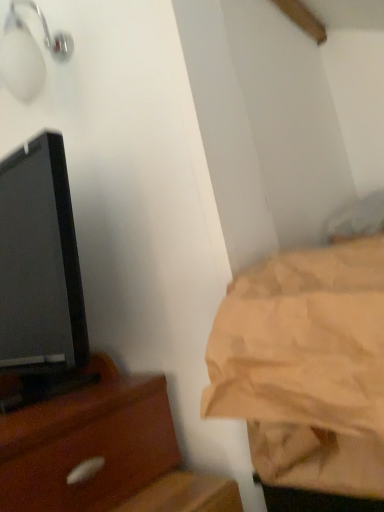
Question: Is white glossy light fixture at upper left not inside beige fabric bedsheet at right?

Choices:
 (A) no
 (B) yes

Answer: (B)

Question: Is beige fabric bedsheet at right surrounded by white glossy light fixture at upper left?

Choices:
 (A) yes
 (B) no

Answer: (B)

Question: Would you say white glossy light fixture at upper left is a long distance from beige fabric bedsheet at right?

Choices:
 (A) no
 (B) yes

Answer: (A)

Question: Does white glossy light fixture at upper left have a greater height compared to beige fabric bedsheet at right?

Choices:
 (A) no
 (B) yes

Answer: (A)

Question: Is white glossy light fixture at upper left positioned with its back to beige fabric bedsheet at right?

Choices:
 (A) no
 (B) yes

Answer: (A)

Question: Looking at the image, does white glossy light fixture at upper left seem bigger or smaller compared to black glossy tv at left?

Choices:
 (A) small
 (B) big

Answer: (A)

Question: In the image, is white glossy light fixture at upper left on the left side or the right side of black glossy tv at left?

Choices:
 (A) right
 (B) left

Answer: (A)

Question: Relative to black glossy tv at left, is white glossy light fixture at upper left in front or behind?

Choices:
 (A) behind
 (B) front

Answer: (A)

Question: Is white glossy light fixture at upper left wider or thinner than black glossy tv at left?

Choices:
 (A) wide
 (B) thin

Answer: (B)

Question: Considering the positions of beige fabric bedsheet at right and black glossy tv at left in the image, is beige fabric bedsheet at right taller or shorter than black glossy tv at left?

Choices:
 (A) tall
 (B) short

Answer: (B)

Question: Is beige fabric bedsheet at right inside or outside of black glossy tv at left?

Choices:
 (A) inside
 (B) outside

Answer: (B)

Question: Looking at their shapes, would you say beige fabric bedsheet at right is wider or thinner than black glossy tv at left?

Choices:
 (A) wide
 (B) thin

Answer: (B)

Question: From the image's perspective, is beige fabric bedsheet at right positioned above or below black glossy tv at left?

Choices:
 (A) above
 (B) below

Answer: (B)

Question: From the image's perspective, is beige fabric bedsheet at right positioned above or below white glossy light fixture at upper left?

Choices:
 (A) above
 (B) below

Answer: (B)

Question: Relative to white glossy light fixture at upper left, is beige fabric bedsheet at right in front or behind?

Choices:
 (A) behind
 (B) front

Answer: (B)